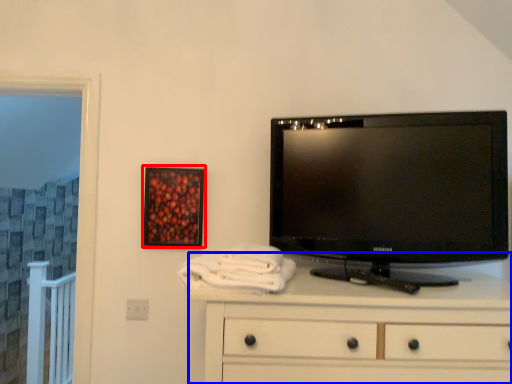
Question: Which point is further to the camera, picture frame (highlighted by a red box) or chest of drawers (highlighted by a blue box)?

Choices:
 (A) picture frame
 (B) chest of drawers

Answer: (A)